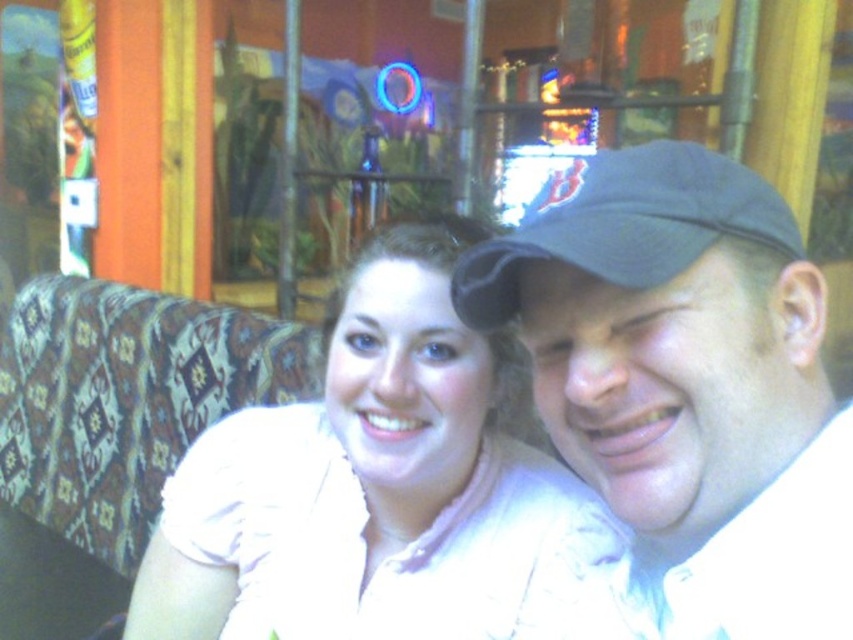
You are a photographer trying to capture a clear shot of both the black fabric cap at upper right and the dark blue fabric baseball cap at upper right. Since you want to ensure both caps are visible in the frame, which cap should you focus on first to account for their sizes?

The black fabric cap at upper right is taller than the dark blue fabric baseball cap at upper right, so you should focus on the black fabric cap at upper right first to ensure its full height is captured in the frame.

You are a photographer standing at the camera position. You want to place a small decoration exactly 50 centimeters away from where you are standing. Can you use the point marked at coordinates point [698,228] to determine if it is the correct distance?

The point [698,228] is 50.47 centimeters from the camera, so yes, it is approximately 50 centimeters away. You can use this point for placing the decoration.

In the scene shown: You are a photographer trying to capture a clear shot of both the black fabric cap at upper right and the dark blue fabric baseball cap at upper right. Since you want to ensure both caps are visible in the frame, which cap should you focus on first to account for their sizes?

The black fabric cap at upper right is larger in size than the dark blue fabric baseball cap at upper right, so you should focus on the dark blue fabric baseball cap at upper right first to ensure it is in focus and properly framed alongside the larger cap.